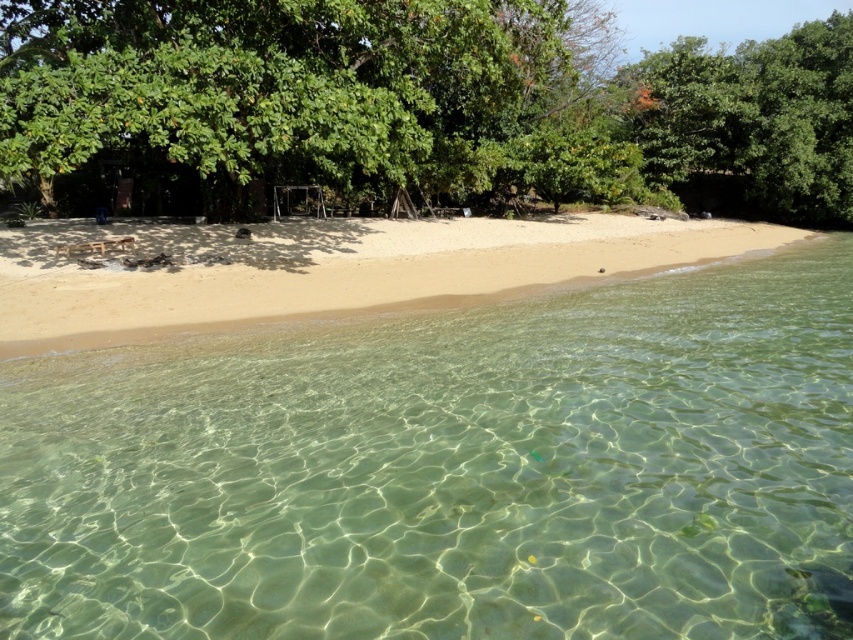
Is point (451, 80) positioned in front of point (618, 243)?

That is True.

Is green leafy tree at upper center to the left of sandy beach at center from the viewer's perspective?

In fact, green leafy tree at upper center is to the right of sandy beach at center.

Where is `green leafy tree at upper center`? green leafy tree at upper center is located at coordinates (422, 104).

Find the location of a particular element. The image size is (853, 640). green leafy tree at upper center is located at coordinates (422, 104).

You are a GUI agent. You are given a task and a screenshot of the screen. Output one action in this format:
    pyautogui.click(x=<x>, y=<y>)
    Task: Click on the clear water at center
    This screenshot has height=640, width=853.
    Given the screenshot: What is the action you would take?
    pyautogui.click(x=451, y=468)

Is point (763, 468) in front of point (335, 45)?

Yes, it is.

Identify the location of clear water at center. The image size is (853, 640). (451, 468).

Which is in front, point (163, 480) or point (840, 128)?

Point (163, 480) is more forward.

Does point (647, 592) lie behind point (683, 77)?

That is False.

Where is `clear water at center`? The width and height of the screenshot is (853, 640). clear water at center is located at coordinates (451, 468).